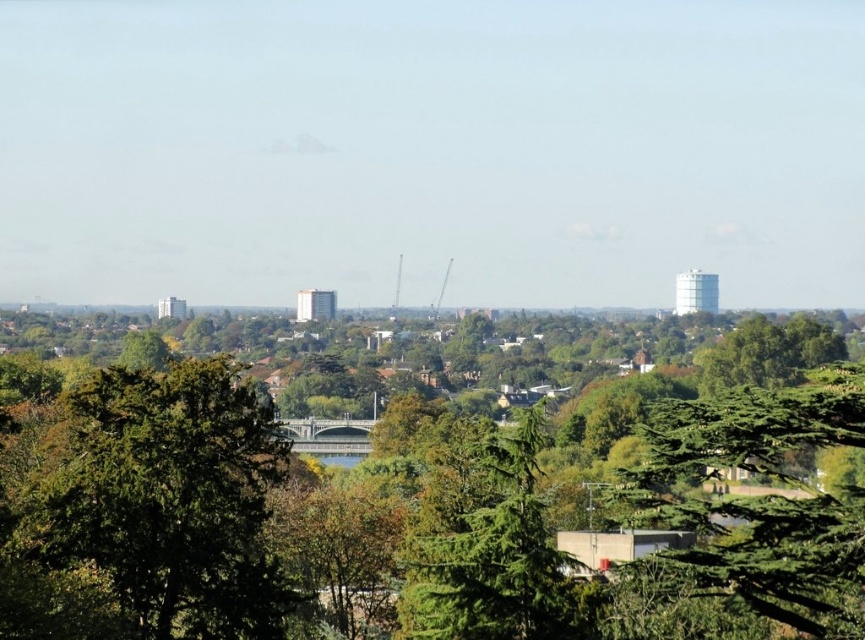
You are a landscape architect planning to plant new trees in the city park. You have two options based on the image provided. The first option is the green leafy tree at lower left, and the second is the green textured tree at lower right. Which tree has a wider canopy? Please base your answer on the spatial details provided in the scene.

The green textured tree at lower right has a wider canopy than the green leafy tree at lower left.